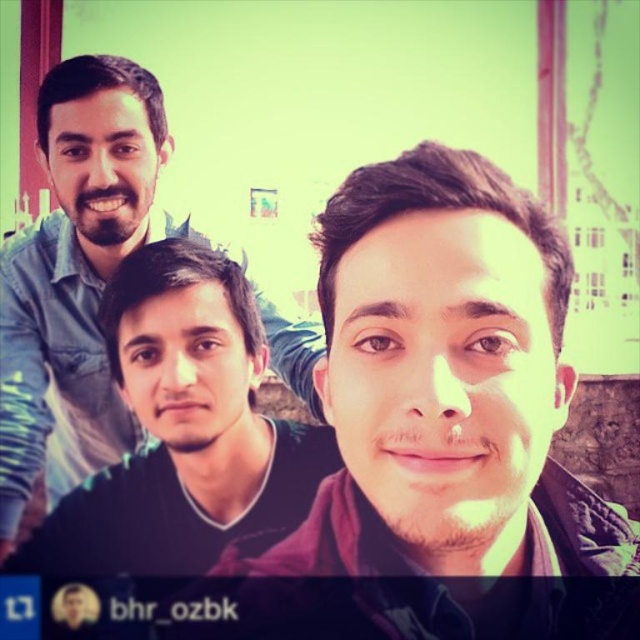
How far apart are smooth skin face at center and matte blue shirt at upper left?

3.62 feet

Find the location of a particular element. smooth skin face at center is located at coordinates (440, 429).